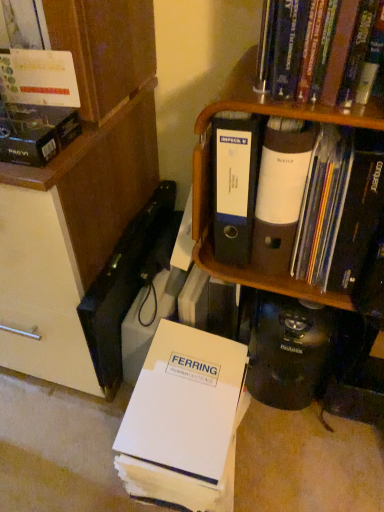
Locate an element on the screen. This screenshot has height=512, width=384. free location to the left of white paper folder at lower center, placed as the 4th book when sorted from top to bottom is located at coordinates (69, 448).